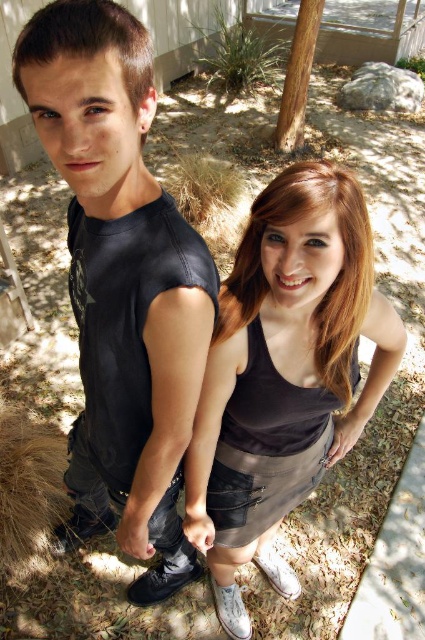
Question: Does matte black t-shirt at center have a lesser width compared to matte black tank top at center?

Choices:
 (A) yes
 (B) no

Answer: (B)

Question: Does matte black t-shirt at center have a greater width compared to brown rough bark at upper center?

Choices:
 (A) yes
 (B) no

Answer: (A)

Question: Among these points, which one is nearest to the camera?

Choices:
 (A) (308, 80)
 (B) (59, 541)

Answer: (B)

Question: Which point is closer to the camera taking this photo?

Choices:
 (A) (357, 198)
 (B) (309, 33)
 (C) (147, 436)

Answer: (A)

Question: Can you confirm if matte black tank top at center is positioned above brown rough bark at upper center?

Choices:
 (A) no
 (B) yes

Answer: (A)

Question: Which object is closer to the camera taking this photo?

Choices:
 (A) brown rough bark at upper center
 (B) matte black tank top at center
 (C) matte black t-shirt at center

Answer: (C)